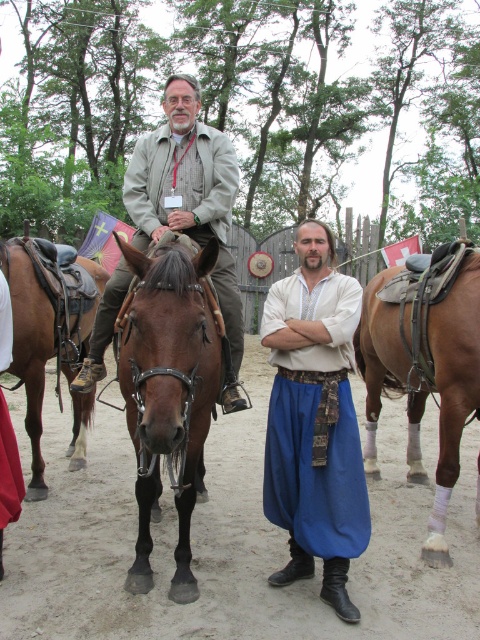
Question: Can you confirm if brown leather saddle at right is positioned above matte beige jacket at center?

Choices:
 (A) yes
 (B) no

Answer: (B)

Question: Is brown leather horse at center bigger than matte white shirt at center?

Choices:
 (A) no
 (B) yes

Answer: (B)

Question: Does brown leather horse at center lie behind brown shiny leather horse at center?

Choices:
 (A) yes
 (B) no

Answer: (A)

Question: Among these objects, which one is farthest from the camera?

Choices:
 (A) brown leather saddle at left
 (B) matte beige jacket at center
 (C) matte white shirt at center

Answer: (A)

Question: Based on their relative distances, which object is farther from the brown shiny leather horse at center?

Choices:
 (A) brown leather saddle at left
 (B) matte white shirt at center
 (C) matte beige jacket at center

Answer: (A)

Question: Which point is farther to the camera?

Choices:
 (A) [218, 163]
 (B) [442, 332]
 (C) [147, 506]

Answer: (B)